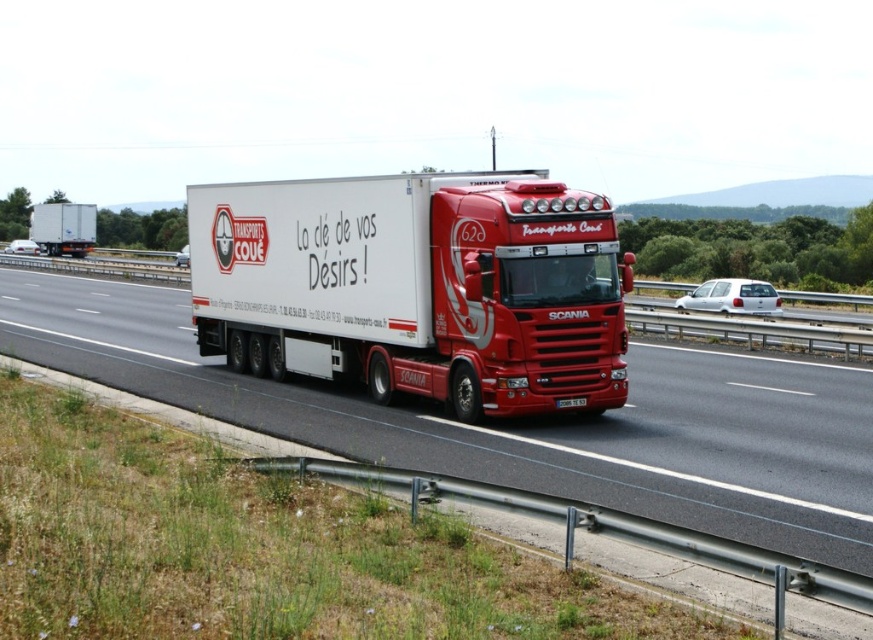
Question: Among these points, which one is nearest to the camera?

Choices:
 (A) coord(437,195)
 (B) coord(32,221)

Answer: (A)

Question: Is white matte truck at center to the left of white glossy trailer at center from the viewer's perspective?

Choices:
 (A) yes
 (B) no

Answer: (B)

Question: Where is white matte truck at center located in relation to black plastic license plate at center in the image?

Choices:
 (A) right
 (B) left

Answer: (B)

Question: Which of the following is the closest to the observer?

Choices:
 (A) white matte truck at center
 (B) white matte trailer truck at center
 (C) black plastic license plate at center

Answer: (A)

Question: Which of these objects is positioned closest to the white glossy trailer at center?

Choices:
 (A) white matte trailer truck at center
 (B) black plastic license plate at center
 (C) white matte truck at center

Answer: (C)

Question: Considering the relative positions of white matte truck at center and white glossy trailer at center in the image provided, where is white matte truck at center located with respect to white glossy trailer at center?

Choices:
 (A) above
 (B) below

Answer: (B)